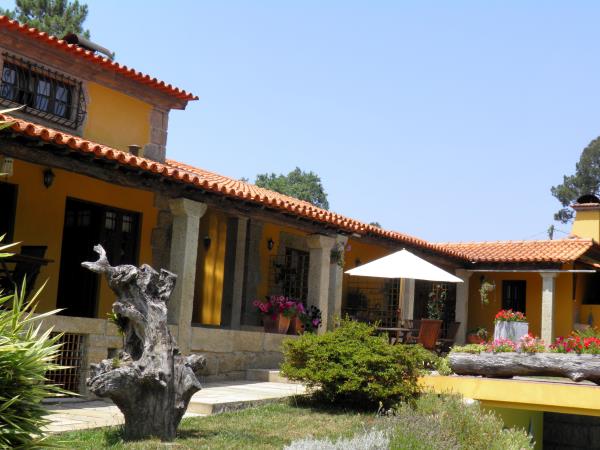
Find the location of a particular element. This screenshot has height=450, width=600. chairs is located at coordinates (429, 333), (454, 335).